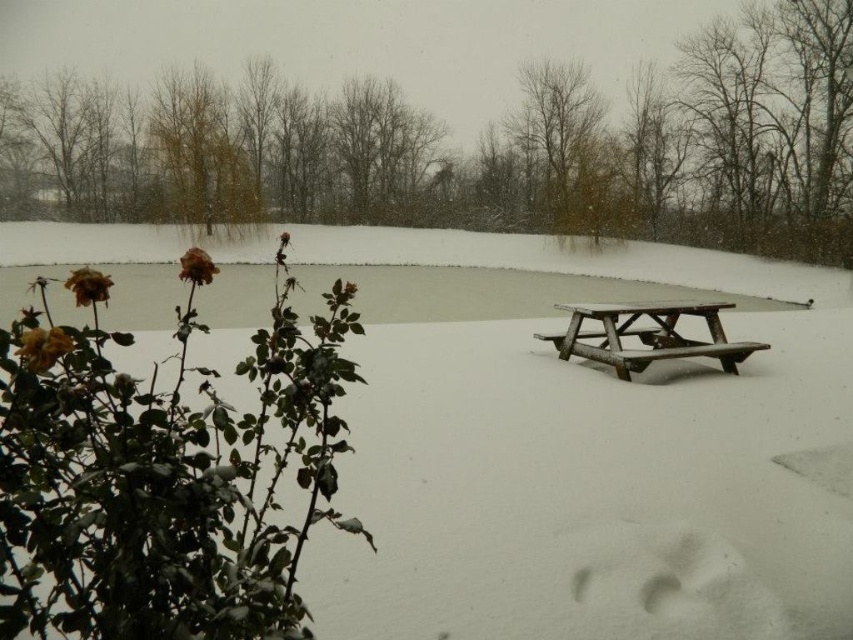
Question: Among these objects, which one is nearest to the camera?

Choices:
 (A) dried rose at left
 (B) dried matte rose at lower left
 (C) wooden picnic table at center
 (D) dried rose at lower left

Answer: (B)

Question: Does brown leafless tree at upper center appear on the right side of dried matte rose at lower left?

Choices:
 (A) no
 (B) yes

Answer: (A)

Question: Does bare branches at upper center appear on the right side of dried rose at left?

Choices:
 (A) yes
 (B) no

Answer: (A)

Question: Which object is closer to the camera taking this photo?

Choices:
 (A) brown leafless tree at upper center
 (B) dried matte rose at lower left
 (C) dried rose at lower left

Answer: (B)

Question: Is the position of bare branches at upper center more distant than that of dried rose at lower left?

Choices:
 (A) no
 (B) yes

Answer: (B)

Question: Which point is farther from the camera taking this photo?

Choices:
 (A) (91, 269)
 (B) (834, 298)
 (C) (683, 308)

Answer: (B)